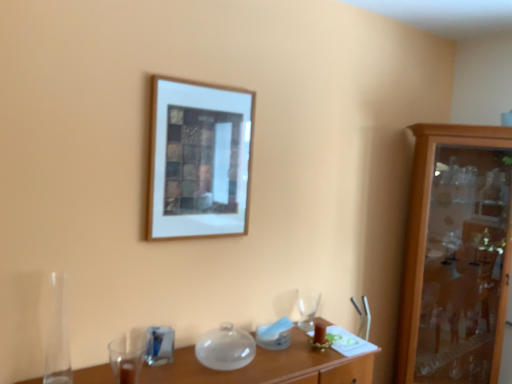
Locate an element on the screen. vacant area that lies between blue glass at lower left, the 2th tableware positioned from the right, and transparent glass vase at lower left is located at coordinates (101, 370).